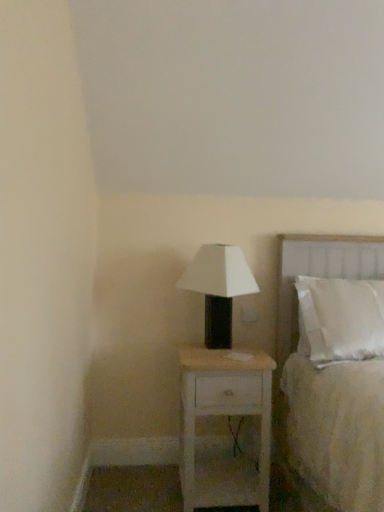
Locate an element on the screen. vacant area on top of white wood nightstand at center (from a real-world perspective) is located at coordinates (228, 350).